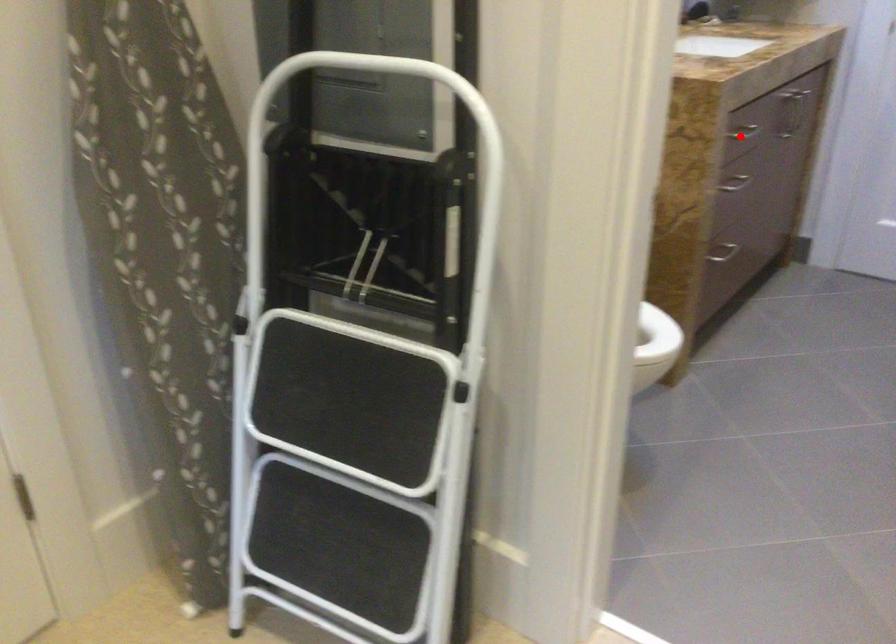
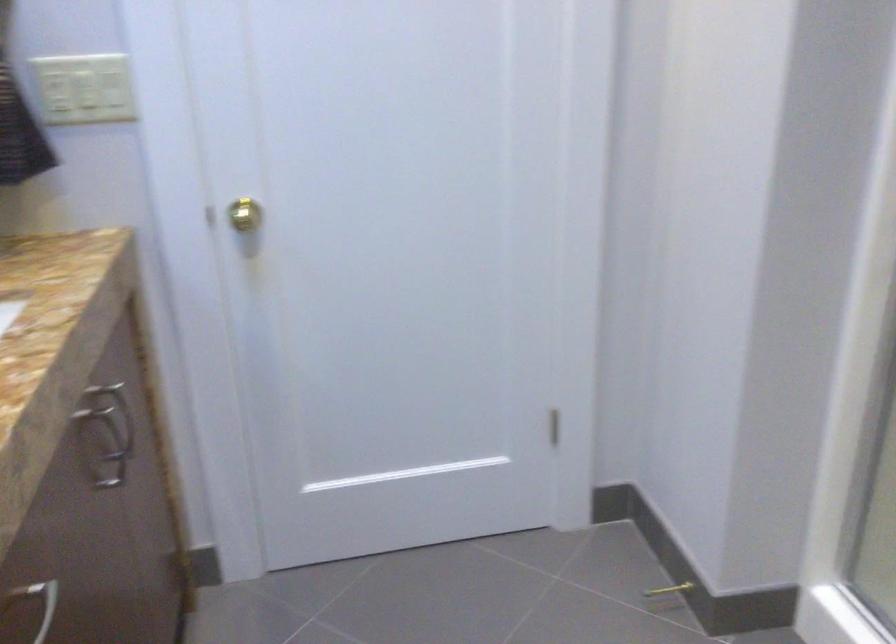
The point at the highlighted location is marked in the first image. Where is the corresponding point in the second image?

(37, 603)